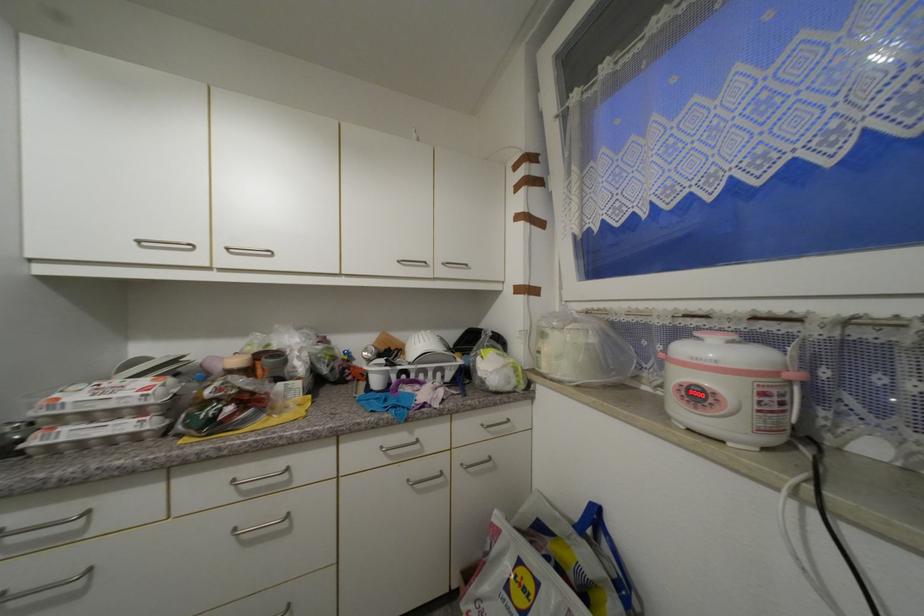
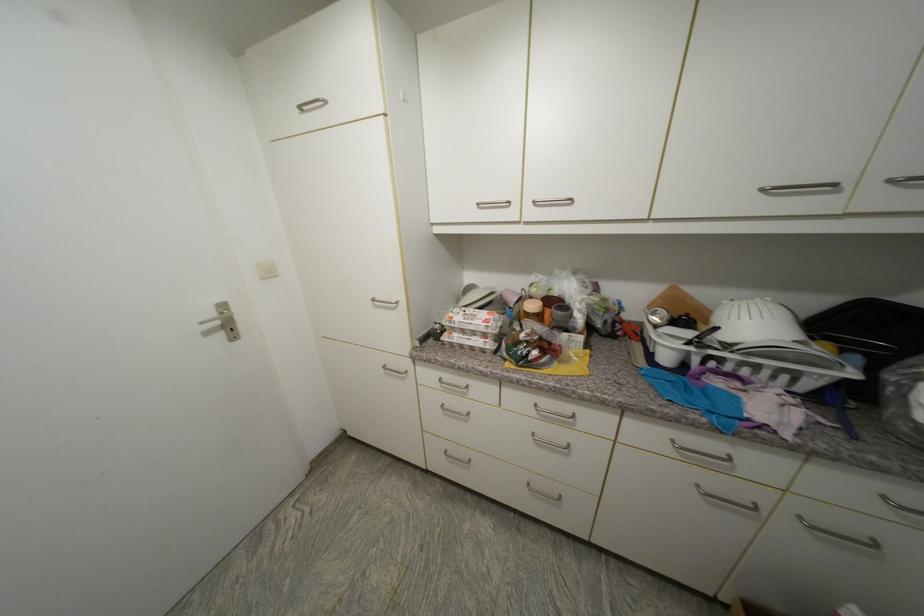
Find the pixel in the second image that matches pixel 387 448 in the first image.

(678, 443)